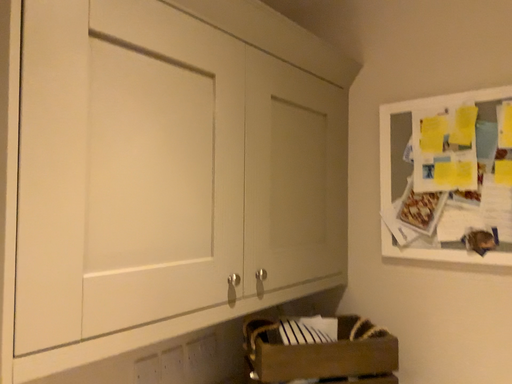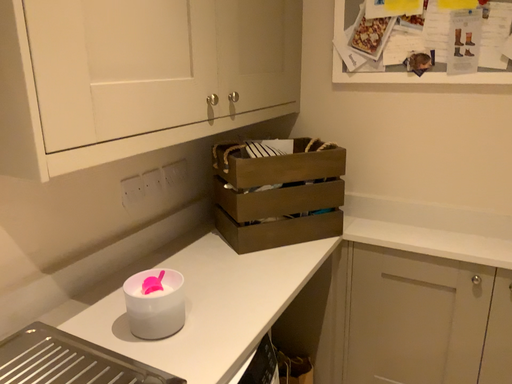
Question: Which way did the camera rotate in the video?

Choices:
 (A) rotated upward
 (B) rotated downward

Answer: (B)